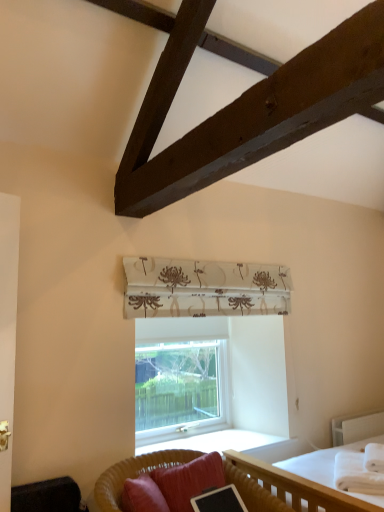
Question: Is velvet black swivel chair at lower left thinner than white soft blanket at lower right?

Choices:
 (A) no
 (B) yes

Answer: (B)

Question: Is velvet black swivel chair at lower left placed right next to white soft blanket at lower right?

Choices:
 (A) yes
 (B) no

Answer: (B)

Question: From a real-world perspective, is velvet black swivel chair at lower left located beneath white soft blanket at lower right?

Choices:
 (A) yes
 (B) no

Answer: (A)

Question: Does velvet black swivel chair at lower left appear on the right side of white soft blanket at lower right?

Choices:
 (A) yes
 (B) no

Answer: (B)

Question: Does velvet black swivel chair at lower left have a lesser height compared to white soft blanket at lower right?

Choices:
 (A) no
 (B) yes

Answer: (A)

Question: Is velvet black swivel chair at lower left looking in the opposite direction of white soft blanket at lower right?

Choices:
 (A) yes
 (B) no

Answer: (B)

Question: From the image's perspective, is woven rattan studio couch at lower center beneath white wooden bed at lower right?

Choices:
 (A) no
 (B) yes

Answer: (A)

Question: Considering the relative positions of woven rattan studio couch at lower center and white wooden bed at lower right in the image provided, is woven rattan studio couch at lower center to the left of white wooden bed at lower right from the viewer's perspective?

Choices:
 (A) yes
 (B) no

Answer: (A)

Question: Is woven rattan studio couch at lower center aimed at white wooden bed at lower right?

Choices:
 (A) no
 (B) yes

Answer: (A)

Question: Considering the relative sizes of woven rattan studio couch at lower center and white wooden bed at lower right in the image provided, is woven rattan studio couch at lower center taller than white wooden bed at lower right?

Choices:
 (A) no
 (B) yes

Answer: (A)

Question: From the image's perspective, is woven rattan studio couch at lower center located above white wooden bed at lower right?

Choices:
 (A) no
 (B) yes

Answer: (B)

Question: Considering the relative sizes of woven rattan studio couch at lower center and white wooden bed at lower right in the image provided, is woven rattan studio couch at lower center shorter than white wooden bed at lower right?

Choices:
 (A) no
 (B) yes

Answer: (B)

Question: From a real-world perspective, is white soft blanket at lower right positioned over clear glass window at center based on gravity?

Choices:
 (A) yes
 (B) no

Answer: (B)